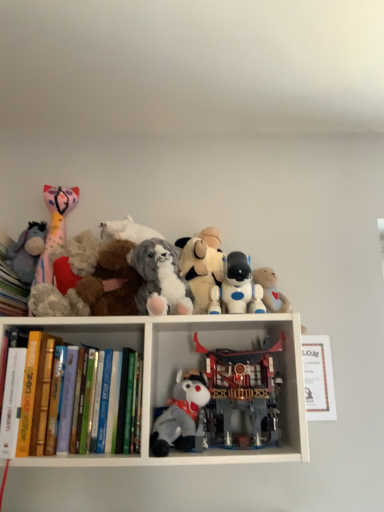
The height and width of the screenshot is (512, 384). Find the location of `white matte books at upper left`. white matte books at upper left is located at coordinates coord(187,368).

What do you see at coordinates (240, 286) in the screenshot?
I see `white plastic robot at center, arranged as the second toy when viewed from the right` at bounding box center [240, 286].

In the scene shown: How much space does white plastic robot at center, arranged as the second toy when viewed from the right, occupy horizontally?

white plastic robot at center, arranged as the second toy when viewed from the right, is 8.95 centimeters in width.

Describe the element at coordinates (182, 416) in the screenshot. I see `fluffy gray plush at center, placed as the fifth toy when sorted from right to left` at that location.

This screenshot has height=512, width=384. What are the coordinates of `fluffy gray plush at center, which ranks as the fourth toy in left-to-right order` in the screenshot? It's located at (182, 416).

Image resolution: width=384 pixels, height=512 pixels. What do you see at coordinates (160, 279) in the screenshot?
I see `fluffy gray plush at center, which ranks as the 3th toy in left-to-right order` at bounding box center [160, 279].

At what (x,y) coordinates should I click in order to perform the action: click on wooden bear at upper center, which is the eighth toy from left to right. Please return your answer as a coordinate pair (x, y). Looking at the image, I should click on (271, 290).

From a real-world perspective, relative to fluffy gray plush at center, which ranks as the fourth toy in left-to-right order, is hardcover book at left, positioned as the 1th book in top-to-bottom order, vertically above or below?

hardcover book at left, positioned as the 1th book in top-to-bottom order, is situated higher than fluffy gray plush at center, which ranks as the fourth toy in left-to-right order, in the real world.

Is hardcover book at left, the 1th book in the left-to-right sequence, positioned far away from fluffy gray plush at center, placed as the fifth toy when sorted from right to left?

No, hardcover book at left, the 1th book in the left-to-right sequence, is in close proximity to fluffy gray plush at center, placed as the fifth toy when sorted from right to left.

Is hardcover book at left, arranged as the second book when ordered from the bottom, positioned beyond the bounds of fluffy gray plush at center, placed as the fifth toy when sorted from right to left?

hardcover book at left, arranged as the second book when ordered from the bottom, is positioned outside fluffy gray plush at center, placed as the fifth toy when sorted from right to left.

Looking at the image, does hardcover book at left, positioned as the 1th book in top-to-bottom order, seem bigger or smaller compared to fluffy gray plush at center, which ranks as the fourth toy in left-to-right order?

hardcover book at left, positioned as the 1th book in top-to-bottom order, is bigger than fluffy gray plush at center, which ranks as the fourth toy in left-to-right order.

Is wooden bear at upper center, which is the eighth toy from left to right, closer to camera compared to plush purple at left, which is the 1th toy from left to right?

No, the depth of wooden bear at upper center, which is the eighth toy from left to right, is greater than that of plush purple at left, which is the 1th toy from left to right.

The height and width of the screenshot is (512, 384). What are the coordinates of `the 4th toy below the plush purple at left, acting as the eighth toy starting from the right (from a real-world perspective)` in the screenshot? It's located at (271, 290).

From a real-world perspective, who is located higher, wooden bear at upper center, which is the eighth toy from left to right, or plush purple at left, which is the 1th toy from left to right?

From a 3D spatial view, plush purple at left, which is the 1th toy from left to right, is above.

Considering the sizes of objects hardcover books at left, the 2th book viewed from the left, and fluffy gray plush at center, which ranks as the fourth toy in left-to-right order, in the image provided, who is smaller, hardcover books at left, the 2th book viewed from the left, or fluffy gray plush at center, which ranks as the fourth toy in left-to-right order,?

Smaller between the two is fluffy gray plush at center, which ranks as the fourth toy in left-to-right order.

From the image's perspective, is hardcover books at left, acting as the 2th book starting from the top, above fluffy gray plush at center, placed as the fifth toy when sorted from right to left?

Indeed, from the image's perspective, hardcover books at left, acting as the 2th book starting from the top, is shown above fluffy gray plush at center, placed as the fifth toy when sorted from right to left.

Is hardcover books at left, the 2th book viewed from the left, facing towards fluffy gray plush at center, placed as the fifth toy when sorted from right to left?

No, hardcover books at left, the 2th book viewed from the left, does not turn towards fluffy gray plush at center, placed as the fifth toy when sorted from right to left.

Can you confirm if hardcover books at left, the first book ordered from the bottom, is shorter than fluffy gray plush at center, placed as the fifth toy when sorted from right to left?

Incorrect, the height of hardcover books at left, the first book ordered from the bottom, does not fall short of that of fluffy gray plush at center, placed as the fifth toy when sorted from right to left.

Could you tell me if hardcover book at left, which is the 2th paperback book from right to left, is turned towards white paper at upper center, positioned as the 3th paperback book in left-to-right order?

No, hardcover book at left, which is the 2th paperback book from right to left, is not oriented towards white paper at upper center, positioned as the 3th paperback book in left-to-right order.

Can you confirm if hardcover book at left, which is the 2th paperback book from right to left, is bigger than white paper at upper center, positioned as the 3th paperback book in left-to-right order?

Indeed, hardcover book at left, which is the 2th paperback book from right to left, has a larger size compared to white paper at upper center, positioned as the 3th paperback book in left-to-right order.

Which point is more distant from viewer, [42,356] or [316,370]?

Positioned behind is point [316,370].

The width and height of the screenshot is (384, 512). I want to click on the 1st paperback book in front of the white paper at upper center, positioned as the 3th paperback book in left-to-right order, so click(42, 395).

Which object is thinner, white paper at upper center, positioned as the 1th paperback book in right-to-left order, or white matte books at upper left?

Thinner between the two is white paper at upper center, positioned as the 1th paperback book in right-to-left order.

How different are the orientations of white paper at upper center, positioned as the 3th paperback book in left-to-right order, and white matte books at upper left in degrees?

They differ by 0.00293 degrees in their facing directions.

Considering the positions of objects white paper at upper center, positioned as the 3th paperback book in left-to-right order, and white matte books at upper left in the image provided, who is more to the right, white paper at upper center, positioned as the 3th paperback book in left-to-right order, or white matte books at upper left?

Positioned to the right is white paper at upper center, positioned as the 3th paperback book in left-to-right order.

Is white paper at upper center, positioned as the 1th paperback book in right-to-left order, completely or partially outside of white matte books at upper left?

white paper at upper center, positioned as the 1th paperback book in right-to-left order, is positioned outside white matte books at upper left.

From the image's perspective, which one is positioned lower, reddish-brown plastic building at center, the sixth toy in the left-to-right sequence, or white paper at upper center, positioned as the 1th paperback book in right-to-left order?

white paper at upper center, positioned as the 1th paperback book in right-to-left order, appears lower in the image.

Which of these two, reddish-brown plastic building at center, the third toy positioned from the right, or white paper at upper center, positioned as the 3th paperback book in left-to-right order, is bigger?

With larger size is reddish-brown plastic building at center, the third toy positioned from the right.

From a real-world perspective, which object rests below the other?

From a 3D spatial view, reddish-brown plastic building at center, the third toy positioned from the right, is below.

Is the surface of reddish-brown plastic building at center, the third toy positioned from the right, in direct contact with white paper at upper center, positioned as the 3th paperback book in left-to-right order?

No, reddish-brown plastic building at center, the third toy positioned from the right, is not with white paper at upper center, positioned as the 3th paperback book in left-to-right order.

Is reddish-brown plastic building at center, the sixth toy in the left-to-right sequence, a part of white paper at upper center, positioned as the 3th paperback book in left-to-right order?

No, white paper at upper center, positioned as the 3th paperback book in left-to-right order, does not contain reddish-brown plastic building at center, the sixth toy in the left-to-right sequence.

Which of these two, white paper at upper center, positioned as the 1th paperback book in right-to-left order, or reddish-brown plastic building at center, the sixth toy in the left-to-right sequence, is thinner?

With smaller width is white paper at upper center, positioned as the 1th paperback book in right-to-left order.

Which is closer, (315, 341) or (275, 346)?

The point (275, 346) is closer to the camera.

At what (x,y) coordinates should I click in order to perform the action: click on the 3rd toy directly beneath the hardcover book at left, arranged as the second book when ordered from the bottom (from a real-world perspective). Please return your answer as a coordinate pair (x, y). The image size is (384, 512). Looking at the image, I should click on (182, 416).

This screenshot has width=384, height=512. What are the coordinates of `the 7th toy counting from the left of the wooden bear at upper center, which is the eighth toy from left to right` in the screenshot? It's located at (27, 251).

Which object lies nearer to the anchor point white matte books at upper left, fluffy beige stuffed animal at center, the fourth toy positioned from the right, or wooden bear at upper center, which is the eighth toy from left to right?

fluffy beige stuffed animal at center, the fourth toy positioned from the right.

Which object lies further to the anchor point white matte books at upper left, fluffy beige stuffed animal at center, positioned as the 5th toy in left-to-right order, or hardcover book at left, which is the second paperback book from left to right?

Among the two, hardcover book at left, which is the second paperback book from left to right, is located further to white matte books at upper left.

Which object lies nearer to the anchor point fluffy gray plush at center, marked as the sixth toy in a right-to-left arrangement, wooden bear at upper center, which is the eighth toy from left to right, or white paper at upper center, positioned as the 1th paperback book in right-to-left order?

wooden bear at upper center, which is the eighth toy from left to right, is closer to fluffy gray plush at center, marked as the sixth toy in a right-to-left arrangement.

Based on their spatial positions, is fluffy gray plush at center, which ranks as the 3th toy in left-to-right order, or white plastic robot at center, positioned as the 7th toy in left-to-right order, further from white matte books at upper left?

The object further to white matte books at upper left is white plastic robot at center, positioned as the 7th toy in left-to-right order.

Estimate the real-world distances between objects in this image. Which object is closer to reddish-brown plastic building at center, the third toy positioned from the right, hardcover book at left, positioned as the 1th book in top-to-bottom order, or white plastic robot at center, arranged as the second toy when viewed from the right?

The object closer to reddish-brown plastic building at center, the third toy positioned from the right, is white plastic robot at center, arranged as the second toy when viewed from the right.

When comparing their distances from hardcover book at left, arranged as the second book when ordered from the bottom, does reddish-brown plastic building at center, the sixth toy in the left-to-right sequence, or white matte books at upper left seem closer?

white matte books at upper left is positioned closer to the anchor hardcover book at left, arranged as the second book when ordered from the bottom.

When comparing their distances from white matte books at upper left, does white paper at upper center, positioned as the 1th paperback book in right-to-left order, or white plastic robot at center, positioned as the 7th toy in left-to-right order, seem closer?

white plastic robot at center, positioned as the 7th toy in left-to-right order, is positioned closer to the anchor white matte books at upper left.

Looking at this image, looking at the image, which one is located closer to fluffy pink and white plush toy at left, arranged as the 2th toy when viewed from the left, hardcover book at left, which is the 2th paperback book from right to left, or reddish-brown plastic building at center, the third toy positioned from the right?

The object closer to fluffy pink and white plush toy at left, arranged as the 2th toy when viewed from the left, is hardcover book at left, which is the 2th paperback book from right to left.

I want to click on shelf located between hardcover books at left, the 2th book viewed from the left, and white plastic robot at center, positioned as the 7th toy in left-to-right order, in the left-right direction, so click(187, 368).

Where is `book between fluffy pink and white plush toy at left, the 7th toy in the right-to-left sequence, and white paper at upper center, positioned as the 3th paperback book in left-to-right order, from left to right`? The height and width of the screenshot is (512, 384). book between fluffy pink and white plush toy at left, the 7th toy in the right-to-left sequence, and white paper at upper center, positioned as the 3th paperback book in left-to-right order, from left to right is located at coordinates (61, 421).

Find the location of a particular element. shelf between hardcover book at left, which appears as the 2th book when viewed from the right, and white plastic robot at center, arranged as the second toy when viewed from the right is located at coordinates (187, 368).

The height and width of the screenshot is (512, 384). I want to click on shelf between fluffy beige stuffed animal at center, the fourth toy positioned from the right, and fluffy gray plush at center, which ranks as the fourth toy in left-to-right order, in the up-down direction, so click(187, 368).